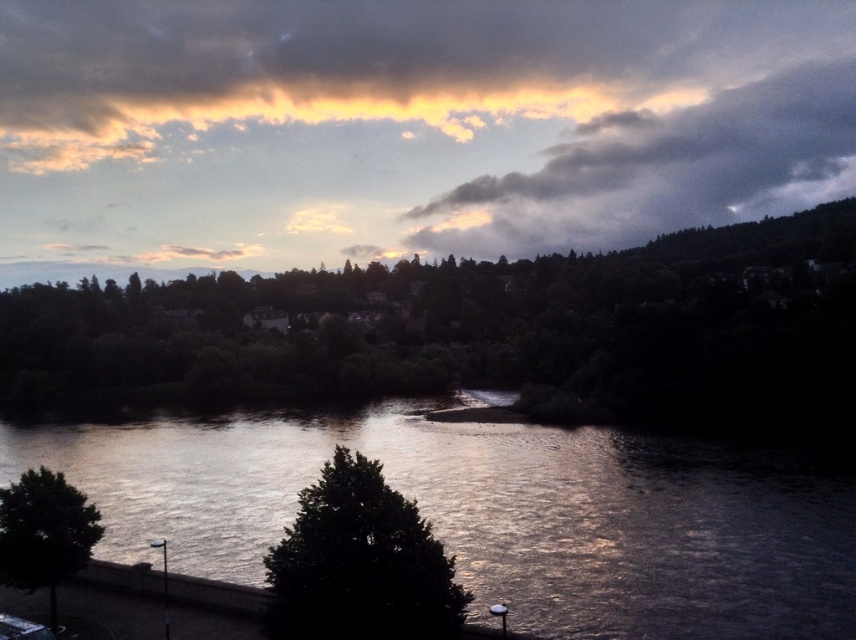
Describe the element at coordinates (498, 513) in the screenshot. I see `silvery reflective water at center` at that location.

Is silvery reflective water at center thinner than dark green leafy tree at center?

Incorrect, silvery reflective water at center's width is not less than dark green leafy tree at center's.

Where is `silvery reflective water at center`? The image size is (856, 640). silvery reflective water at center is located at coordinates (498, 513).

Where is `silvery reflective water at center`? This screenshot has height=640, width=856. silvery reflective water at center is located at coordinates (498, 513).

Is point (531, 276) closer to viewer compared to point (272, 502)?

No.

Is green leafy tree at center to the left of silvery reflective water at center from the viewer's perspective?

Incorrect, green leafy tree at center is not on the left side of silvery reflective water at center.

Which is behind, point (807, 333) or point (533, 464)?

Point (807, 333)

At what (x,y) coordinates should I click in order to perform the action: click on green leafy tree at center. Please return your answer as a coordinate pair (x, y). The width and height of the screenshot is (856, 640). Looking at the image, I should click on (474, 332).

Does point (408, 365) come behind point (717, 115)?

No, (408, 365) is in front of (717, 115).

Can you confirm if green leafy tree at center is thinner than cloudy sky at upper center?

Indeed, green leafy tree at center has a lesser width compared to cloudy sky at upper center.

Is point (846, 234) closer to viewer compared to point (831, 93)?

Yes, it is.

Locate an element on the screen. This screenshot has width=856, height=640. green leafy tree at center is located at coordinates (474, 332).